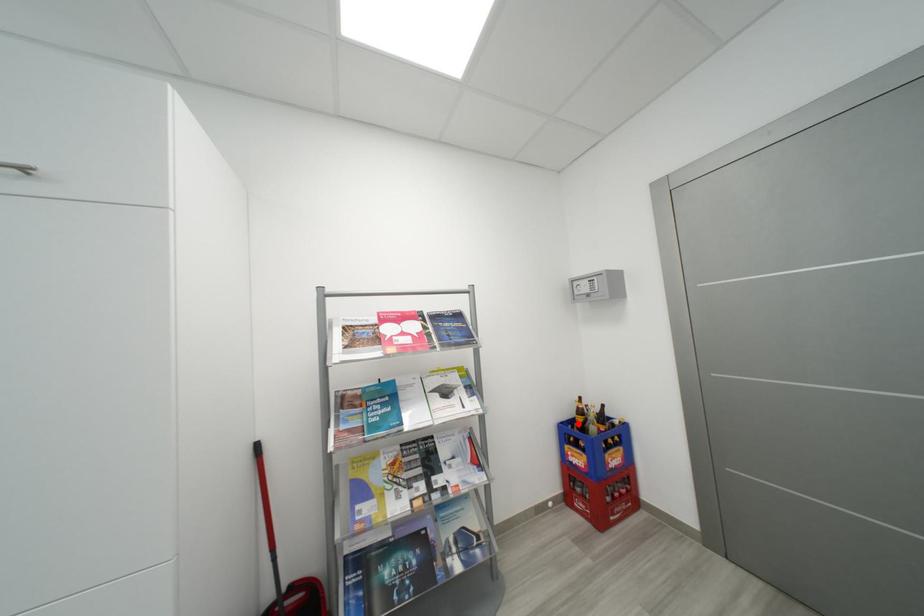
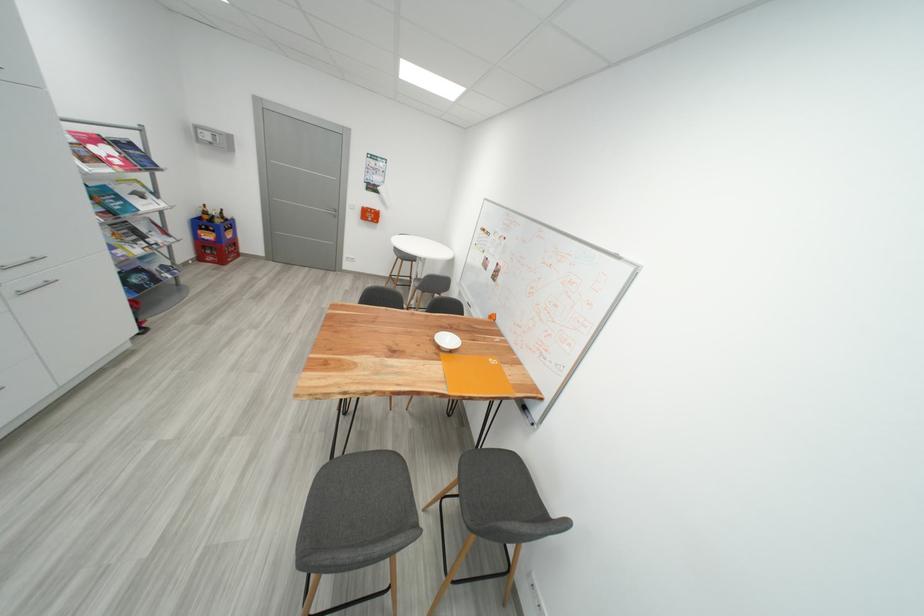
Question: I am providing you with two images of the same scene from different viewpoints. Image1 has a red point marked. In image2, the corresponding 3D location appears at what relative position? Reply with the corresponding letter.

Choices:
 (A) Closer
 (B) Farther

Answer: (A)